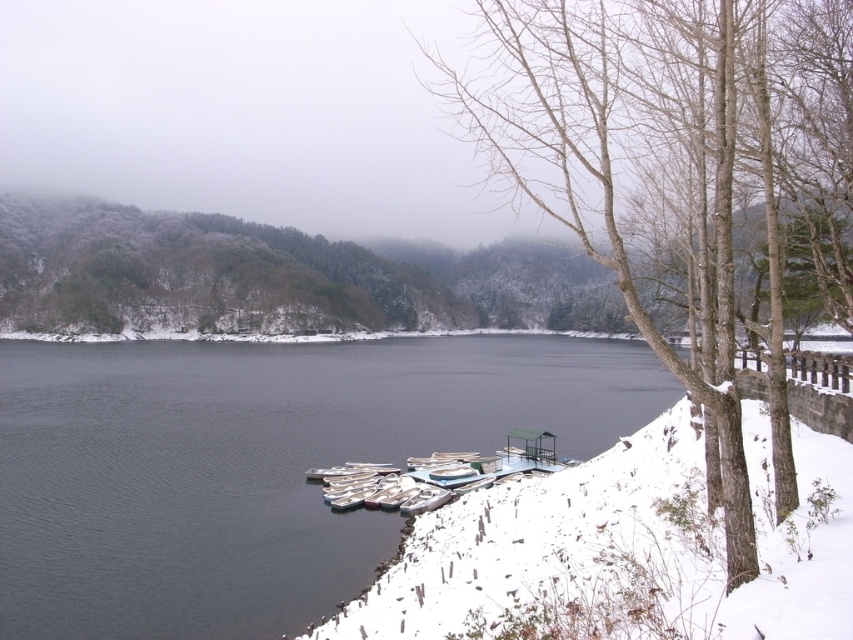
Question: Is dark water at center bigger than white matte boats at lower center?

Choices:
 (A) yes
 (B) no

Answer: (A)

Question: Which of the following is the closest to the observer?

Choices:
 (A) bare wood tree at right
 (B) white matte boats at lower center
 (C) dark water at center

Answer: (A)

Question: Which object is the farthest from the white matte boats at lower center?

Choices:
 (A) bare wood tree at right
 (B) dark water at center

Answer: (A)

Question: Is dark water at center positioned in front of white matte boats at lower center?

Choices:
 (A) yes
 (B) no

Answer: (A)

Question: Is dark water at center positioned before white matte boats at lower center?

Choices:
 (A) yes
 (B) no

Answer: (A)

Question: Which point appears farthest from the camera in this image?

Choices:
 (A) (363, 502)
 (B) (148, 396)
 (C) (558, 113)

Answer: (B)